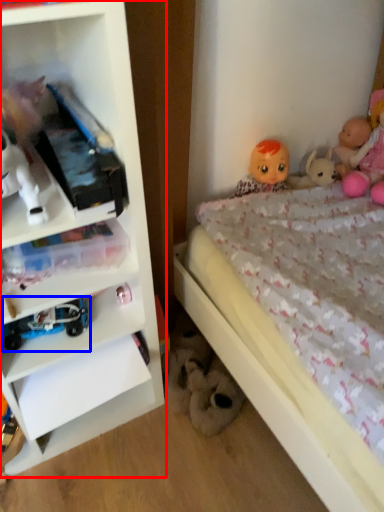
Question: Among these objects, which one is farthest to the camera, shelf (highlighted by a red box) or toy (highlighted by a blue box)?

Choices:
 (A) shelf
 (B) toy

Answer: (B)